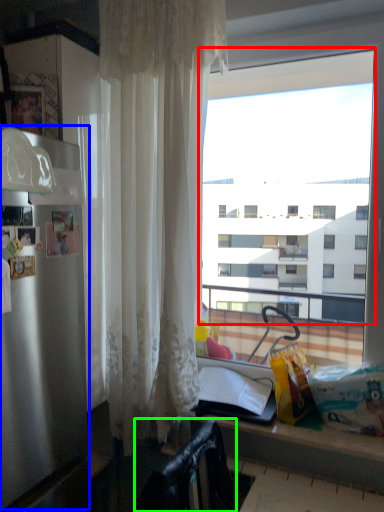
Question: Which object is the closest to the window (highlighted by a red box)? Choose among these: appliance (highlighted by a blue box) or chair (highlighted by a green box).

Choices:
 (A) appliance
 (B) chair

Answer: (A)